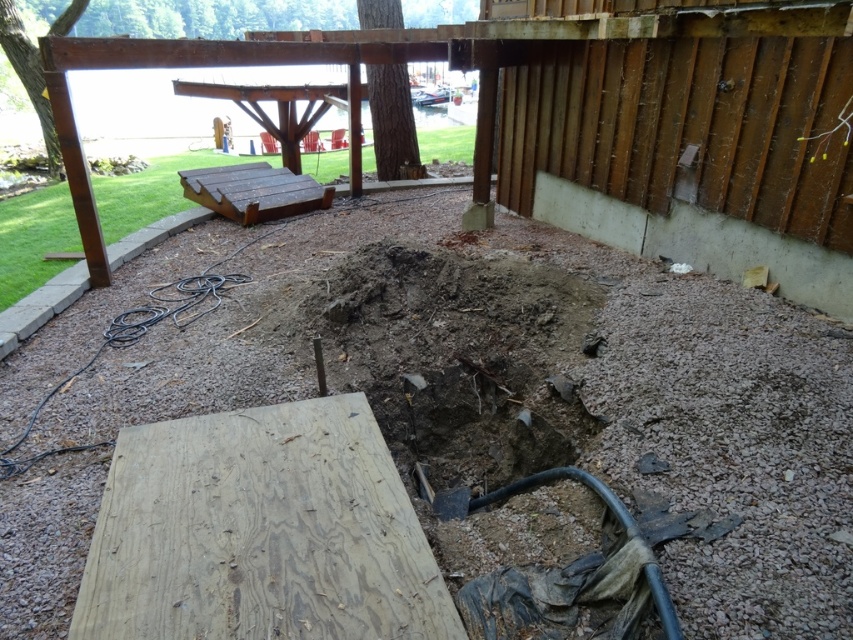
Question: Which point is farther to the camera?

Choices:
 (A) (827, 312)
 (B) (109, 259)

Answer: (B)

Question: Does gray concrete foundation at right appear on the left side of black rubber hose at lower left?

Choices:
 (A) yes
 (B) no

Answer: (B)

Question: Does gray concrete foundation at right have a smaller size compared to black rubber hose at lower left?

Choices:
 (A) no
 (B) yes

Answer: (A)

Question: Is gray concrete foundation at right smaller than brown wooden picnic table at upper left?

Choices:
 (A) yes
 (B) no

Answer: (B)

Question: Estimate the real-world distances between objects in this image. Which object is closer to the black rubber hose at lower left?

Choices:
 (A) gray concrete foundation at right
 (B) brown wooden picnic table at upper left

Answer: (B)

Question: Which of the following is the closest to the observer?

Choices:
 (A) brown wooden picnic table at upper left
 (B) gray concrete foundation at right
 (C) black rubber hose at lower left

Answer: (B)